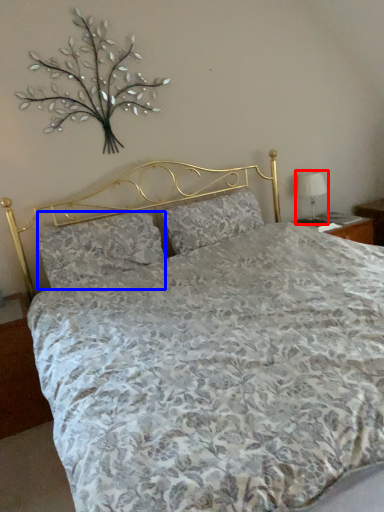
Question: Which object is closer to the camera taking this photo, table lamp (highlighted by a red box) or pillow (highlighted by a blue box)?

Choices:
 (A) table lamp
 (B) pillow

Answer: (B)